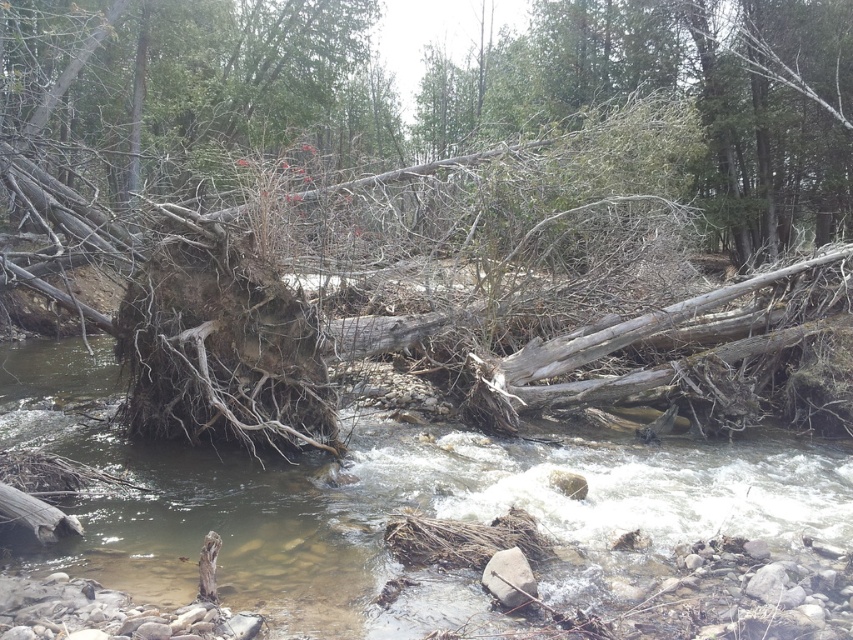
Question: Can you confirm if brown wood at center is positioned to the right of gray rough rock at center?

Choices:
 (A) no
 (B) yes

Answer: (A)

Question: Which point is farther from the camera taking this photo?

Choices:
 (A) (498, 573)
 (B) (387, 449)

Answer: (B)

Question: Does brown wood at center appear over gray rough rock at center?

Choices:
 (A) yes
 (B) no

Answer: (A)

Question: Can you confirm if brown wood at center is positioned above gray rough rock at center?

Choices:
 (A) yes
 (B) no

Answer: (A)